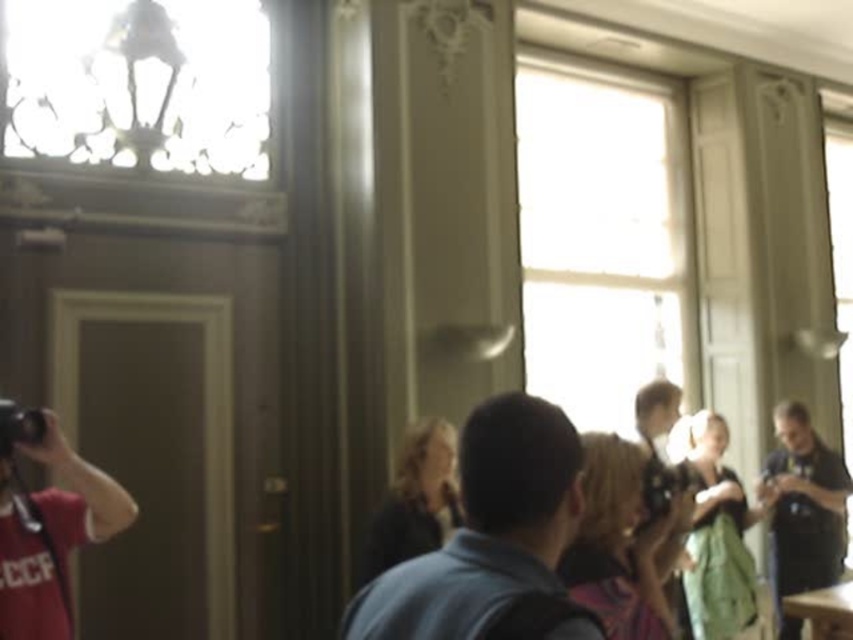
Question: Which of the following is the farthest from the observer?

Choices:
 (A) (555, 435)
 (B) (410, 502)
 (C) (38, 429)
 (D) (694, 548)

Answer: (D)

Question: Which object is positioned closest to the green fabric dress at center?

Choices:
 (A) dark blue shirt at center
 (B) matte red t-shirt at left
 (C) dark gray shirt at right

Answer: (C)

Question: Does matte red t-shirt at left have a larger size compared to black plastic camera at left?

Choices:
 (A) no
 (B) yes

Answer: (B)

Question: Is dark blue shirt at center wider than multicolored fabric bag at center?

Choices:
 (A) yes
 (B) no

Answer: (B)

Question: Which of the following is the farthest from the observer?

Choices:
 (A) black plastic camera at left
 (B) dark gray shirt at right

Answer: (B)

Question: Can you confirm if dark blue shirt at center is wider than multicolored fabric bag at center?

Choices:
 (A) yes
 (B) no

Answer: (B)